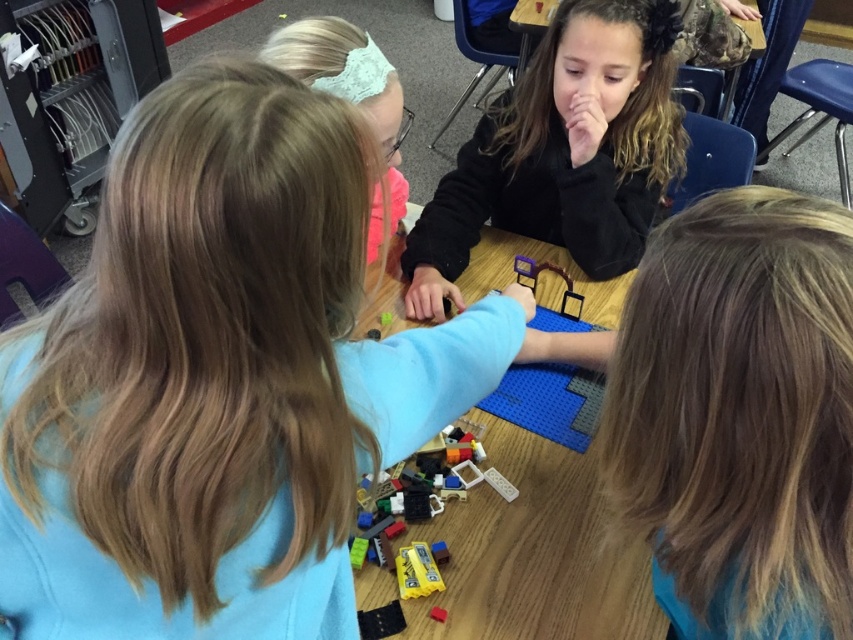
You are a teacher in the classroom. You notice two translucent plastic items on the table where children are working with building blocks. The items are the translucent plastic lego pieces at lower center and the translucent plastic toy at center. You need to place a ruler between them to measure the distance. How far apart are these two items?

The translucent plastic lego pieces at lower center and the translucent plastic toy at center are 41.77 centimeters apart from each other.

You are a child at the table and want to pick up the smooth plastic lego at center and the translucent plastic lego pieces at lower center. Which one is closer to you?

The smooth plastic lego at center is closer to you because it is in front of the translucent plastic lego pieces at lower center.

You are a child at the table and want to pick up the smooth plastic lego at center and the translucent plastic lego pieces at lower center. Which one should you reach for first if you want to grab the one that is closer to you?

The translucent plastic lego pieces at lower center are closer to you because they are positioned below the smooth plastic lego at center, which is above them.